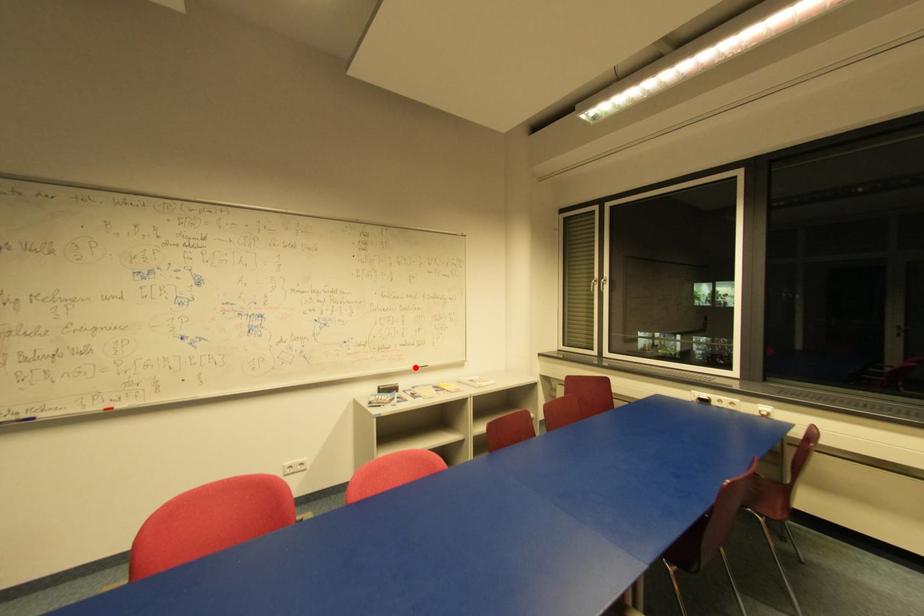
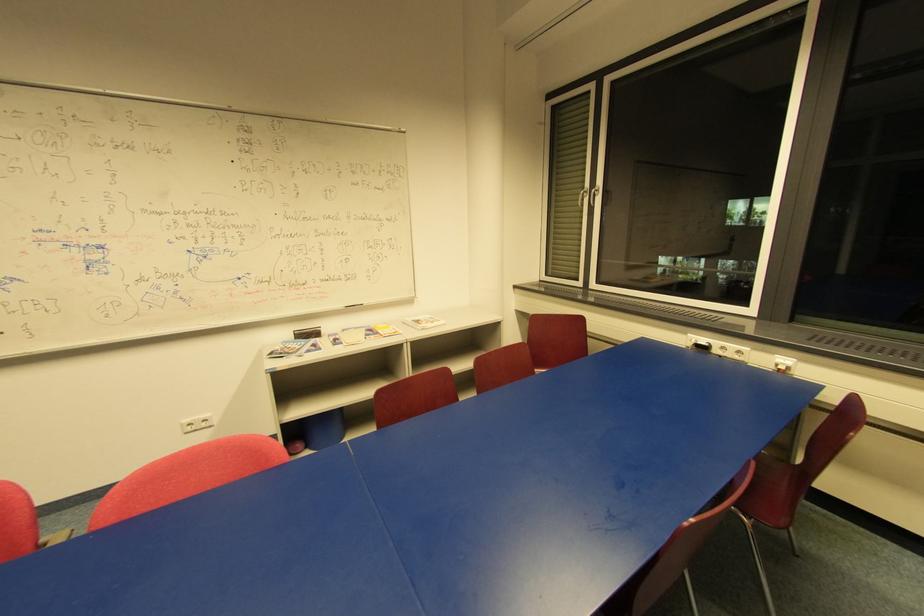
The point at the highlighted location is marked in the first image. Where is the corresponding point in the second image?

(344, 307)